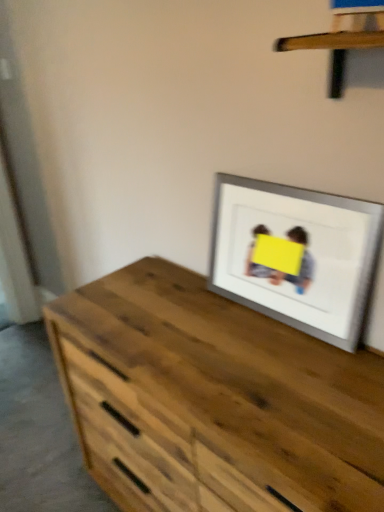
I want to click on free region under wooden at upper center (from a real-world perspective), so click(x=327, y=350).